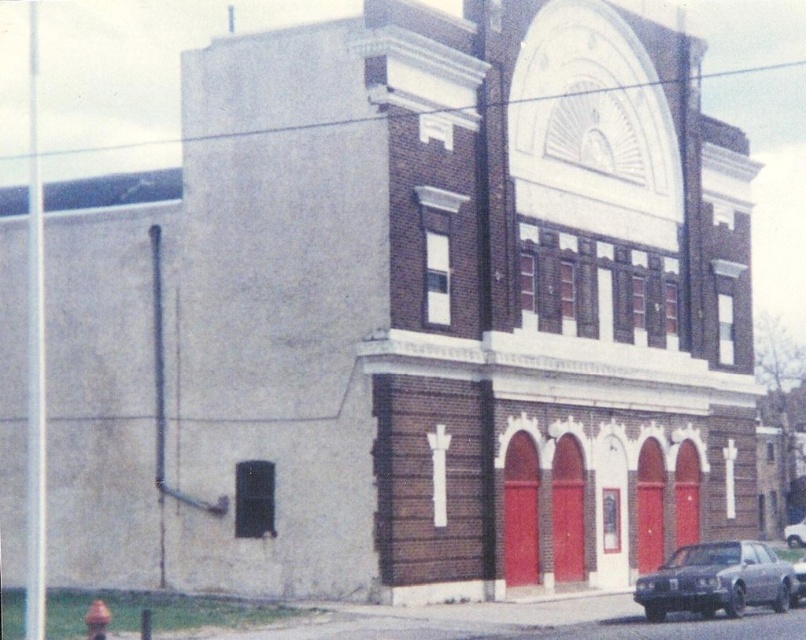
Does metallic gray sedan at lower right appear on the left side of green rubber fire hydrant at lower left?

No, metallic gray sedan at lower right is not to the left of green rubber fire hydrant at lower left.

Consider the image. Does metallic gray sedan at lower right have a greater height compared to green rubber fire hydrant at lower left?

Indeed, metallic gray sedan at lower right has a greater height compared to green rubber fire hydrant at lower left.

Does point (708, 609) come behind point (84, 621)?

That is True.

Find the location of a particular element. This screenshot has height=640, width=806. metallic gray sedan at lower right is located at coordinates (717, 580).

Can you confirm if metallic gray sedan at lower right is smaller than shiny silver car at lower right?

No, metallic gray sedan at lower right is not smaller than shiny silver car at lower right.

Can you confirm if metallic gray sedan at lower right is positioned to the right of shiny silver car at lower right?

No, metallic gray sedan at lower right is not to the right of shiny silver car at lower right.

Describe the element at coordinates (717, 580) in the screenshot. I see `metallic gray sedan at lower right` at that location.

Where is `metallic gray sedan at lower right`? This screenshot has height=640, width=806. metallic gray sedan at lower right is located at coordinates (717, 580).

Is green rubber fire hydrant at lower left positioned before shiny silver car at lower right?

That is True.

Can you confirm if green rubber fire hydrant at lower left is positioned to the right of shiny silver car at lower right?

No, green rubber fire hydrant at lower left is not to the right of shiny silver car at lower right.

Is point (98, 600) positioned in front of point (798, 522)?

That is True.

What are the coordinates of `green rubber fire hydrant at lower left` in the screenshot? It's located at (96, 620).